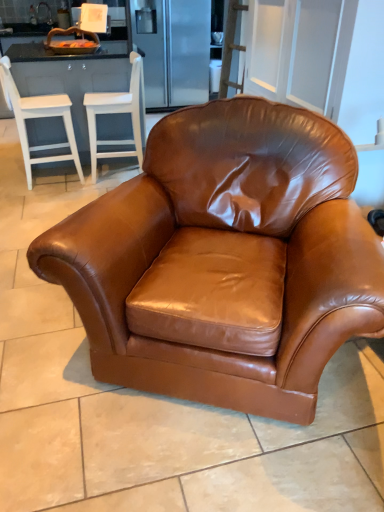
Question: Are brown leather armchair at center, the third chair in the front-to-back sequence, and saddle brown leather armchair at center, which ranks as the 1th chair in right-to-left order, making contact?

Choices:
 (A) yes
 (B) no

Answer: (B)

Question: Considering the relative sizes of brown leather armchair at center, the third chair in the front-to-back sequence, and saddle brown leather armchair at center, which is counted as the third chair, starting from the left, in the image provided, is brown leather armchair at center, the third chair in the front-to-back sequence, thinner than saddle brown leather armchair at center, which is counted as the third chair, starting from the left,?

Choices:
 (A) yes
 (B) no

Answer: (A)

Question: Is brown leather armchair at center, which ranks as the first chair in back-to-front order, positioned beyond the bounds of saddle brown leather armchair at center, which ranks as the 1th chair in right-to-left order?

Choices:
 (A) yes
 (B) no

Answer: (A)

Question: Is brown leather armchair at center, positioned as the second chair in right-to-left order, taller than saddle brown leather armchair at center, the first chair in the front-to-back sequence?

Choices:
 (A) yes
 (B) no

Answer: (B)

Question: Would you say brown leather armchair at center, the second chair viewed from the left, contains saddle brown leather armchair at center, the first chair in the front-to-back sequence?

Choices:
 (A) yes
 (B) no

Answer: (B)

Question: Considering the positions of white wood bar stool at left, the first chair positioned from the left, and saddle brown leather armchair at center, acting as the third chair starting from the back, in the image, is white wood bar stool at left, the first chair positioned from the left, taller or shorter than saddle brown leather armchair at center, acting as the third chair starting from the back,?

Choices:
 (A) short
 (B) tall

Answer: (A)

Question: Is point (49, 112) closer or farther from the camera than point (185, 172)?

Choices:
 (A) closer
 (B) farther

Answer: (B)

Question: From the image's perspective, relative to saddle brown leather armchair at center, the first chair in the front-to-back sequence, is white wood bar stool at left, placed as the second chair when sorted from back to front, above or below?

Choices:
 (A) above
 (B) below

Answer: (A)

Question: From a real-world perspective, is white wood bar stool at left, placed as the second chair when sorted from back to front, physically located above or below saddle brown leather armchair at center, which is counted as the third chair, starting from the left?

Choices:
 (A) below
 (B) above

Answer: (A)

Question: Considering the positions of saddle brown leather armchair at center, the first chair in the front-to-back sequence, and brown leather armchair at center, positioned as the second chair in right-to-left order, in the image, is saddle brown leather armchair at center, the first chair in the front-to-back sequence, wider or thinner than brown leather armchair at center, positioned as the second chair in right-to-left order,?

Choices:
 (A) wide
 (B) thin

Answer: (A)

Question: Considering their positions, is saddle brown leather armchair at center, which is counted as the third chair, starting from the left, located in front of or behind brown leather armchair at center, the second chair viewed from the left?

Choices:
 (A) behind
 (B) front

Answer: (B)

Question: From the image's perspective, is saddle brown leather armchair at center, which is counted as the third chair, starting from the left, above or below brown leather armchair at center, the second chair viewed from the left?

Choices:
 (A) below
 (B) above

Answer: (A)

Question: Does point (107, 256) appear closer or farther from the camera than point (114, 155)?

Choices:
 (A) farther
 (B) closer

Answer: (B)

Question: Looking at the image, does white wood bar stool at left, arranged as the second chair when viewed from the front, seem bigger or smaller compared to white wood barstools at left?

Choices:
 (A) small
 (B) big

Answer: (A)

Question: From the image's perspective, is white wood bar stool at left, placed as the second chair when sorted from back to front, positioned above or below white wood barstools at left?

Choices:
 (A) above
 (B) below

Answer: (B)